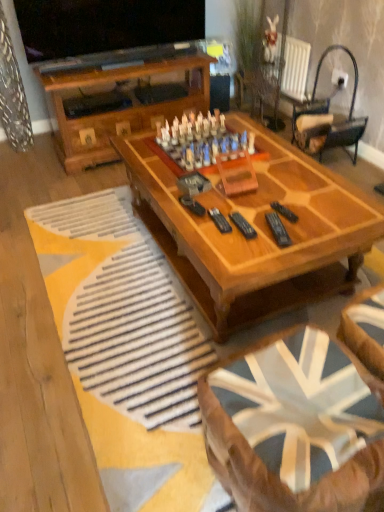
The image size is (384, 512). Identify the location of empty space that is in between black plastic remote at center, positioned as the first remote in right-to-left order, and black plastic remote at center, which is the 2th remote in left-to-right order. (281, 223).